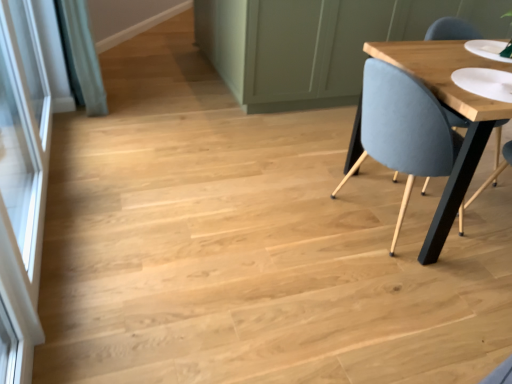
Describe the element at coordinates (21, 186) in the screenshot. I see `transparent glass screen door at left` at that location.

Locate an element on the screen. transparent glass screen door at left is located at coordinates (21, 186).

What is the approximate height of transparent glass screen door at left?

It is 35.06 inches.

What do you see at coordinates (403, 129) in the screenshot?
I see `light blue fabric chair at right` at bounding box center [403, 129].

Find the location of a particular element. light blue fabric chair at right is located at coordinates (403, 129).

The height and width of the screenshot is (384, 512). I want to click on transparent glass screen door at left, so click(21, 186).

Does light blue fabric chair at right appear on the left side of transparent glass screen door at left?

No.

Which is in front, light blue fabric chair at right or transparent glass screen door at left?

transparent glass screen door at left is more forward.

Which is nearer, (394, 84) or (7, 31)?

The point (394, 84) is more forward.

From the image's perspective, is light blue fabric chair at right located above or below transparent glass screen door at left?

light blue fabric chair at right is above transparent glass screen door at left.

From a real-world perspective, is light blue fabric chair at right on transparent glass screen door at left?

No, from a real-world perspective, light blue fabric chair at right is not over transparent glass screen door at left

In the scene shown: Which object is wider, light blue fabric chair at right or transparent glass screen door at left?

light blue fabric chair at right.

From the picture: Considering the relative sizes of light blue fabric chair at right and transparent glass screen door at left in the image provided, is light blue fabric chair at right shorter than transparent glass screen door at left?

Correct, light blue fabric chair at right is not as tall as transparent glass screen door at left.

Does light blue fabric chair at right have a larger size compared to transparent glass screen door at left?

Indeed, light blue fabric chair at right has a larger size compared to transparent glass screen door at left.

Consider the image. Is light blue fabric chair at right outside of transparent glass screen door at left?

Yes, light blue fabric chair at right is located beyond the bounds of transparent glass screen door at left.

Would you say light blue fabric chair at right is a long distance from transparent glass screen door at left?

Yes, light blue fabric chair at right and transparent glass screen door at left are quite far apart.

Is light blue fabric chair at right positioned with its back to transparent glass screen door at left?

light blue fabric chair at right is not turned away from transparent glass screen door at left.

Can you tell me how much light blue fabric chair at right and transparent glass screen door at left differ in facing direction?

92.9 degrees.

The width and height of the screenshot is (512, 384). Identify the location of chair that appears on the right of transparent glass screen door at left. (403, 129).

Considering the positions of objects transparent glass screen door at left and light blue fabric chair at right in the image provided, who is more to the left, transparent glass screen door at left or light blue fabric chair at right?

From the viewer's perspective, transparent glass screen door at left appears more on the left side.

In the scene shown: Which object is further away from the camera, transparent glass screen door at left or light blue fabric chair at right?

Positioned behind is light blue fabric chair at right.

Which is farther from the camera, (18, 181) or (396, 127)?

The point (18, 181) is farther from the camera.

From the image's perspective, does transparent glass screen door at left appear higher than light blue fabric chair at right?

Incorrect, from the image's perspective, transparent glass screen door at left is lower than light blue fabric chair at right.

From a real-world perspective, is transparent glass screen door at left positioned under light blue fabric chair at right based on gravity?

No, from a real-world perspective, transparent glass screen door at left is not below light blue fabric chair at right.

Considering the relative sizes of transparent glass screen door at left and light blue fabric chair at right in the image provided, is transparent glass screen door at left thinner than light blue fabric chair at right?

Indeed, transparent glass screen door at left has a lesser width compared to light blue fabric chair at right.

Is transparent glass screen door at left shorter than light blue fabric chair at right?

No.

Is transparent glass screen door at left smaller than light blue fabric chair at right?

Yes.

Is transparent glass screen door at left surrounding light blue fabric chair at right?

That's incorrect, light blue fabric chair at right is not inside transparent glass screen door at left.

Would you say transparent glass screen door at left is a long distance from light blue fabric chair at right?

That's right, there is a large distance between transparent glass screen door at left and light blue fabric chair at right.

Is transparent glass screen door at left turned away from light blue fabric chair at right?

That's not correct — transparent glass screen door at left is not looking away from light blue fabric chair at right.

How many degrees apart are the facing directions of transparent glass screen door at left and light blue fabric chair at right?

They differ by 92.9 degrees in their facing directions.

Locate an element on the screen. The image size is (512, 384). chair behind the transparent glass screen door at left is located at coordinates (403, 129).

You are a GUI agent. You are given a task and a screenshot of the screen. Output one action in this format:
    pyautogui.click(x=<x>, y=<y>)
    Task: Click on the screen door below the light blue fabric chair at right (from the image's perspective)
    The width and height of the screenshot is (512, 384).
    Given the screenshot: What is the action you would take?
    pyautogui.click(x=21, y=186)

What are the coordinates of `chair on the right of transparent glass screen door at left` in the screenshot? It's located at (403, 129).